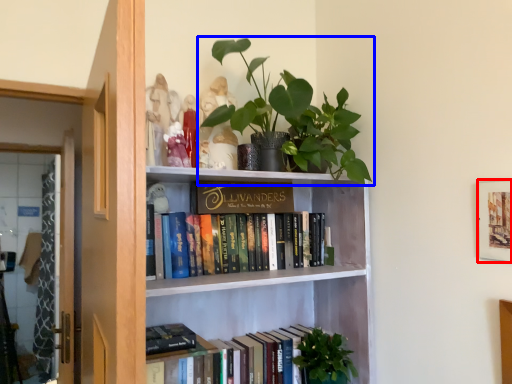
Question: Which point is further to the camera, picture frame (highlighted by a red box) or houseplant (highlighted by a blue box)?

Choices:
 (A) picture frame
 (B) houseplant

Answer: (B)